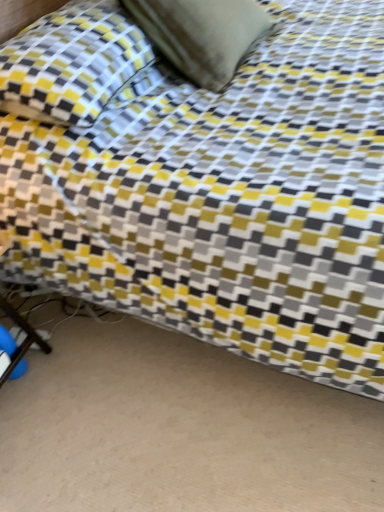
How much space does yellow fabric pillow at upper left, the second pillow in the right-to-left sequence, occupy vertically?

yellow fabric pillow at upper left, the second pillow in the right-to-left sequence, is 10.22 inches in height.

The image size is (384, 512). What do you see at coordinates (71, 63) in the screenshot?
I see `yellow fabric pillow at upper left, the second pillow in the right-to-left sequence` at bounding box center [71, 63].

You are a GUI agent. You are given a task and a screenshot of the screen. Output one action in this format:
    pyautogui.click(x=<x>, y=<y>)
    Task: Click on the yellow fabric pillow at upper left, the 1th pillow when ordered from left to right
    The image size is (384, 512).
    Given the screenshot: What is the action you would take?
    click(x=71, y=63)

What do you see at coordinates (201, 34) in the screenshot? The height and width of the screenshot is (512, 384). I see `suede-like beige pillow at upper center, marked as the second pillow in a left-to-right arrangement` at bounding box center [201, 34].

Measure the distance between suede-like beige pillow at upper center, marked as the second pillow in a left-to-right arrangement, and camera.

suede-like beige pillow at upper center, marked as the second pillow in a left-to-right arrangement, and camera are 4.40 feet apart from each other.

Locate an element on the screen. This screenshot has width=384, height=512. suede-like beige pillow at upper center, the first pillow viewed from the right is located at coordinates (201, 34).

Measure the distance between point (183, 7) and camera.

A distance of 4.42 feet exists between point (183, 7) and camera.

Where is `yellow fabric pillow at upper left, the second pillow in the right-to-left sequence`? This screenshot has width=384, height=512. yellow fabric pillow at upper left, the second pillow in the right-to-left sequence is located at coordinates (71, 63).

Which is more to the right, suede-like beige pillow at upper center, marked as the second pillow in a left-to-right arrangement, or yellow fabric pillow at upper left, the second pillow in the right-to-left sequence?

From the viewer's perspective, suede-like beige pillow at upper center, marked as the second pillow in a left-to-right arrangement, appears more on the right side.

Which is behind, suede-like beige pillow at upper center, marked as the second pillow in a left-to-right arrangement, or yellow fabric pillow at upper left, the second pillow in the right-to-left sequence?

suede-like beige pillow at upper center, marked as the second pillow in a left-to-right arrangement.

Considering the points (143, 20) and (40, 90), which point is in front, point (143, 20) or point (40, 90)?

The point (40, 90) is in front.

From the picture: From the image's perspective, is suede-like beige pillow at upper center, marked as the second pillow in a left-to-right arrangement, beneath yellow fabric pillow at upper left, the second pillow in the right-to-left sequence?

Incorrect, from the image's perspective, suede-like beige pillow at upper center, marked as the second pillow in a left-to-right arrangement, is higher than yellow fabric pillow at upper left, the second pillow in the right-to-left sequence.

From a real-world perspective, does suede-like beige pillow at upper center, the first pillow viewed from the right, stand above yellow fabric pillow at upper left, the second pillow in the right-to-left sequence?

Correct, in the physical world, suede-like beige pillow at upper center, the first pillow viewed from the right, is higher than yellow fabric pillow at upper left, the second pillow in the right-to-left sequence.

Considering the relative sizes of suede-like beige pillow at upper center, the first pillow viewed from the right, and yellow fabric pillow at upper left, the 1th pillow when ordered from left to right, in the image provided, is suede-like beige pillow at upper center, the first pillow viewed from the right, wider than yellow fabric pillow at upper left, the 1th pillow when ordered from left to right,?

No, suede-like beige pillow at upper center, the first pillow viewed from the right, is not wider than yellow fabric pillow at upper left, the 1th pillow when ordered from left to right.

Between suede-like beige pillow at upper center, the first pillow viewed from the right, and yellow fabric pillow at upper left, the second pillow in the right-to-left sequence, which one has more height?

suede-like beige pillow at upper center, the first pillow viewed from the right.

Who is smaller, suede-like beige pillow at upper center, the first pillow viewed from the right, or yellow fabric pillow at upper left, the 1th pillow when ordered from left to right?

suede-like beige pillow at upper center, the first pillow viewed from the right, is smaller.

Which is correct: suede-like beige pillow at upper center, the first pillow viewed from the right, is inside yellow fabric pillow at upper left, the second pillow in the right-to-left sequence, or outside of it?

suede-like beige pillow at upper center, the first pillow viewed from the right, cannot be found inside yellow fabric pillow at upper left, the second pillow in the right-to-left sequence.

Is suede-like beige pillow at upper center, the first pillow viewed from the right, next to yellow fabric pillow at upper left, the 1th pillow when ordered from left to right?

suede-like beige pillow at upper center, the first pillow viewed from the right, and yellow fabric pillow at upper left, the 1th pillow when ordered from left to right, are not in contact.

Based on the photo, could you tell me if suede-like beige pillow at upper center, marked as the second pillow in a left-to-right arrangement, is turned towards yellow fabric pillow at upper left, the 1th pillow when ordered from left to right?

No, suede-like beige pillow at upper center, marked as the second pillow in a left-to-right arrangement, is not facing towards yellow fabric pillow at upper left, the 1th pillow when ordered from left to right.

In the scene shown: What's the angular difference between suede-like beige pillow at upper center, the first pillow viewed from the right, and yellow fabric pillow at upper left, the second pillow in the right-to-left sequence,'s facing directions?

The facing directions of suede-like beige pillow at upper center, the first pillow viewed from the right, and yellow fabric pillow at upper left, the second pillow in the right-to-left sequence, are 0.000442 degrees apart.

Where is `pillow that appears on the left of suede-like beige pillow at upper center, the first pillow viewed from the right`? The width and height of the screenshot is (384, 512). pillow that appears on the left of suede-like beige pillow at upper center, the first pillow viewed from the right is located at coordinates pyautogui.click(x=71, y=63).

Between yellow fabric pillow at upper left, the 1th pillow when ordered from left to right, and suede-like beige pillow at upper center, the first pillow viewed from the right, which one appears on the left side from the viewer's perspective?

From the viewer's perspective, yellow fabric pillow at upper left, the 1th pillow when ordered from left to right, appears more on the left side.

Considering the positions of objects yellow fabric pillow at upper left, the second pillow in the right-to-left sequence, and suede-like beige pillow at upper center, the first pillow viewed from the right, in the image provided, who is in front, yellow fabric pillow at upper left, the second pillow in the right-to-left sequence, or suede-like beige pillow at upper center, the first pillow viewed from the right,?

yellow fabric pillow at upper left, the second pillow in the right-to-left sequence, is in front.

Considering the points (31, 41) and (227, 0), which point is in front, point (31, 41) or point (227, 0)?

The point (31, 41) is closer to the camera.

From the image's perspective, is yellow fabric pillow at upper left, the second pillow in the right-to-left sequence, located above or below suede-like beige pillow at upper center, marked as the second pillow in a left-to-right arrangement?

yellow fabric pillow at upper left, the second pillow in the right-to-left sequence, is below suede-like beige pillow at upper center, marked as the second pillow in a left-to-right arrangement.

From a real-world perspective, does yellow fabric pillow at upper left, the 1th pillow when ordered from left to right, sit lower than suede-like beige pillow at upper center, marked as the second pillow in a left-to-right arrangement?

Yes, from a real-world perspective, yellow fabric pillow at upper left, the 1th pillow when ordered from left to right, is under suede-like beige pillow at upper center, marked as the second pillow in a left-to-right arrangement.

Considering the relative sizes of yellow fabric pillow at upper left, the 1th pillow when ordered from left to right, and suede-like beige pillow at upper center, the first pillow viewed from the right, in the image provided, is yellow fabric pillow at upper left, the 1th pillow when ordered from left to right, thinner than suede-like beige pillow at upper center, the first pillow viewed from the right,?

No, yellow fabric pillow at upper left, the 1th pillow when ordered from left to right, is not thinner than suede-like beige pillow at upper center, the first pillow viewed from the right.

In terms of height, does yellow fabric pillow at upper left, the second pillow in the right-to-left sequence, look taller or shorter compared to suede-like beige pillow at upper center, marked as the second pillow in a left-to-right arrangement?

Considering their sizes, yellow fabric pillow at upper left, the second pillow in the right-to-left sequence, has less height than suede-like beige pillow at upper center, marked as the second pillow in a left-to-right arrangement.

Is yellow fabric pillow at upper left, the second pillow in the right-to-left sequence, smaller than suede-like beige pillow at upper center, the first pillow viewed from the right?

Incorrect, yellow fabric pillow at upper left, the second pillow in the right-to-left sequence, is not smaller in size than suede-like beige pillow at upper center, the first pillow viewed from the right.

Can we say yellow fabric pillow at upper left, the 1th pillow when ordered from left to right, lies outside suede-like beige pillow at upper center, marked as the second pillow in a left-to-right arrangement?

Yes, yellow fabric pillow at upper left, the 1th pillow when ordered from left to right, is located beyond the bounds of suede-like beige pillow at upper center, marked as the second pillow in a left-to-right arrangement.

Is yellow fabric pillow at upper left, the second pillow in the right-to-left sequence, far from suede-like beige pillow at upper center, marked as the second pillow in a left-to-right arrangement?

No, yellow fabric pillow at upper left, the second pillow in the right-to-left sequence, is not far away from suede-like beige pillow at upper center, marked as the second pillow in a left-to-right arrangement.

Is yellow fabric pillow at upper left, the second pillow in the right-to-left sequence, oriented away from suede-like beige pillow at upper center, marked as the second pillow in a left-to-right arrangement?

No, yellow fabric pillow at upper left, the second pillow in the right-to-left sequence, is not facing the opposite direction of suede-like beige pillow at upper center, marked as the second pillow in a left-to-right arrangement.

Can you tell me how much yellow fabric pillow at upper left, the 1th pillow when ordered from left to right, and suede-like beige pillow at upper center, marked as the second pillow in a left-to-right arrangement, differ in facing direction?

They differ by 0.000442 degrees in their facing directions.

This screenshot has width=384, height=512. What are the coordinates of `pillow below the suede-like beige pillow at upper center, marked as the second pillow in a left-to-right arrangement (from the image's perspective)` in the screenshot? It's located at (71, 63).

Find the location of `pillow above the yellow fabric pillow at upper left, the second pillow in the right-to-left sequence (from a real-world perspective)`. pillow above the yellow fabric pillow at upper left, the second pillow in the right-to-left sequence (from a real-world perspective) is located at coordinates (201, 34).

This screenshot has height=512, width=384. I want to click on pillow that is on the right side of yellow fabric pillow at upper left, the second pillow in the right-to-left sequence, so click(201, 34).